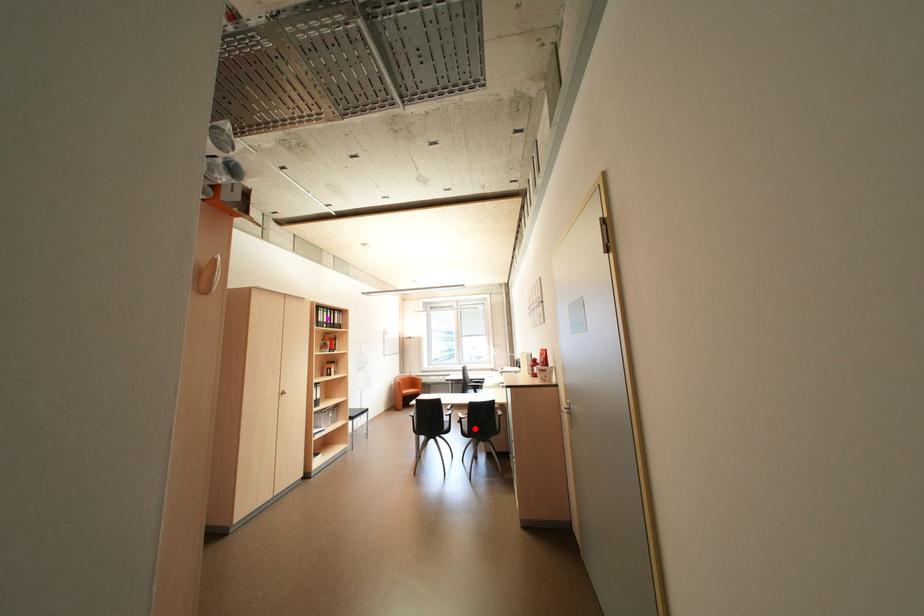
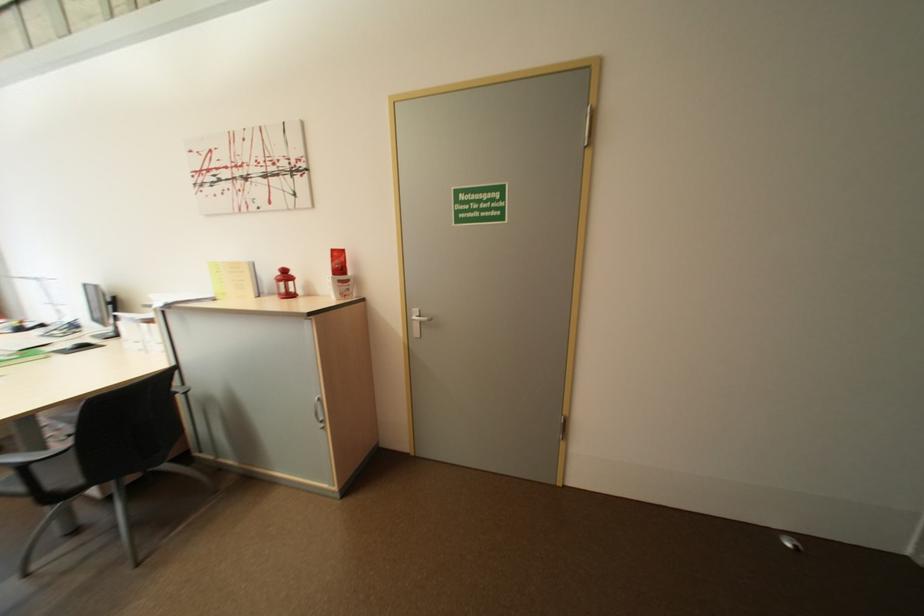
Find the pixel in the second image that matches the highlighted location in the first image.

(75, 477)